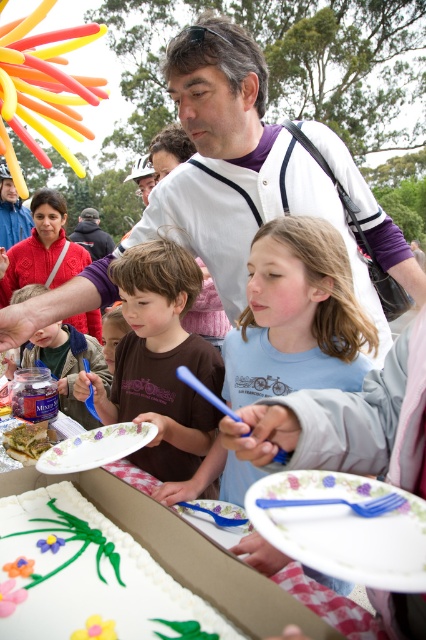
Question: Is white paper plate at lower center below green leafy vegetable at center?

Choices:
 (A) no
 (B) yes

Answer: (A)

Question: Which point is farther to the camera?

Choices:
 (A) white jersey at center
 (B) green leafy vegetable at center

Answer: (B)

Question: Estimate the real-world distances between objects in this image. Which object is farther from the white jersey at center?

Choices:
 (A) white paper plate at lower center
 (B) porcelain floral plate at lower left
 (C) brown cotton shirt at center

Answer: (A)

Question: Can you confirm if white fondant cake at lower left is smaller than green leafy vegetable at center?

Choices:
 (A) yes
 (B) no

Answer: (B)

Question: Is brown cotton shirt at center smaller than porcelain floral plate at lower left?

Choices:
 (A) yes
 (B) no

Answer: (B)

Question: Considering the real-world distances, which object is farthest from the light blue cotton shirt at center?

Choices:
 (A) white fondant cake at lower left
 (B) white paper plate at lower center

Answer: (B)